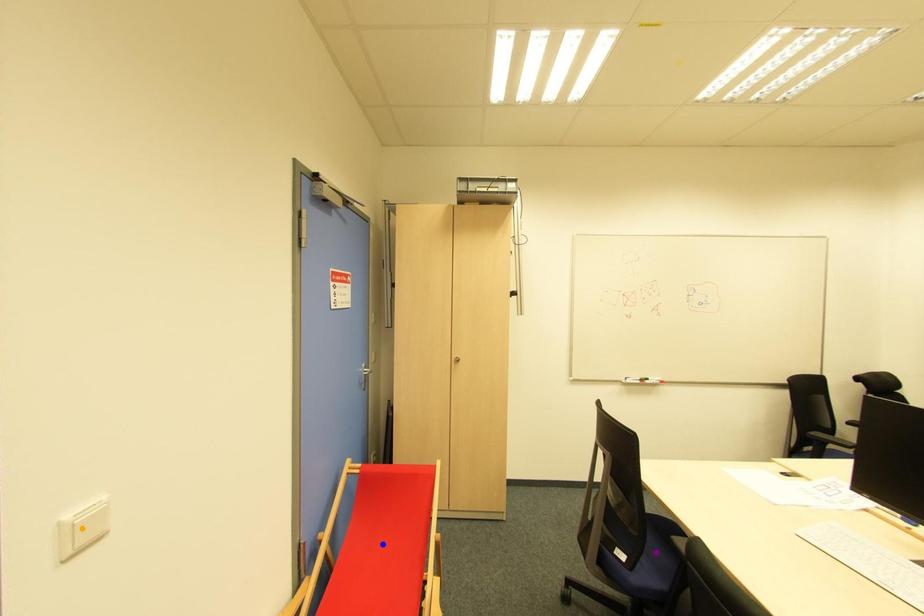
Order these from nearest to farthest:
A) blue point
B) orange point
C) purple point

orange point, purple point, blue point